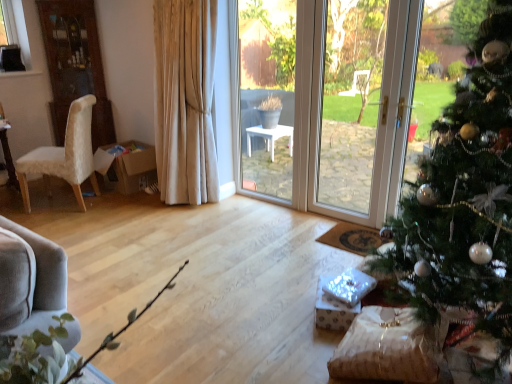
At what (x,y) coordinates should I click in order to perform the action: click on white plush chair at left. Please return your answer as a coordinate pair (x, y). The image size is (512, 384). Looking at the image, I should click on (64, 156).

Image resolution: width=512 pixels, height=384 pixels. Describe the element at coordinates (64, 156) in the screenshot. I see `white plush chair at left` at that location.

The height and width of the screenshot is (384, 512). What do you see at coordinates (464, 200) in the screenshot?
I see `green matte christmas tree at right` at bounding box center [464, 200].

You are a GUI agent. You are given a task and a screenshot of the screen. Output one action in this format:
    pyautogui.click(x=<x>, y=<y>)
    Task: Click on the green matte christmas tree at right
    
    Given the screenshot: What is the action you would take?
    pyautogui.click(x=464, y=200)

Identify the location of white plush chair at left. Image resolution: width=512 pixels, height=384 pixels. (64, 156).

Is green matte christmas tree at right to the left or to the right of white plush chair at left in the image?

From the image, it's evident that green matte christmas tree at right is to the right of white plush chair at left.

Does green matte christmas tree at right come in front of white plush chair at left?

Yes, the depth of green matte christmas tree at right is less than that of white plush chair at left.

Which point is more distant from viewer, (504, 339) or (82, 135)?

Point (82, 135)

From the image's perspective, is green matte christmas tree at right over white plush chair at left?

No, from the image's perspective, green matte christmas tree at right is not on top of white plush chair at left.

From a real-world perspective, is green matte christmas tree at right located beneath white plush chair at left?

Actually, green matte christmas tree at right is physically above white plush chair at left in the real world.

Considering the sizes of objects green matte christmas tree at right and white plush chair at left in the image provided, who is thinner, green matte christmas tree at right or white plush chair at left?

white plush chair at left is thinner.

Is green matte christmas tree at right taller or shorter than white plush chair at left?

green matte christmas tree at right is taller than white plush chair at left.

Based on their sizes in the image, would you say green matte christmas tree at right is bigger or smaller than white plush chair at left?

Clearly, green matte christmas tree at right is larger in size than white plush chair at left.

Consider the image. Would you say green matte christmas tree at right contains white plush chair at left?

No, green matte christmas tree at right does not contain white plush chair at left.

Are green matte christmas tree at right and white plush chair at left located far from each other?

green matte christmas tree at right is positioned a significant distance from white plush chair at left.

Could you tell me if green matte christmas tree at right is turned towards white plush chair at left?

No.

In the image, there is a white plush chair at left. What are the coordinates of `christmas tree below it (from the image's perspective)` in the screenshot? It's located at (464, 200).

In the image, is white plush chair at left on the left side or the right side of green matte christmas tree at right?

Clearly, white plush chair at left is on the left of green matte christmas tree at right in the image.

Is white plush chair at left in front of green matte christmas tree at right?

No, it is behind green matte christmas tree at right.

Is point (75, 132) behind point (490, 84)?

That is True.

From the picture: From the image's perspective, which is above, white plush chair at left or green matte christmas tree at right?

white plush chair at left appears higher in the image.

From a real-world perspective, is white plush chair at left below green matte christmas tree at right?

Indeed, from a real-world perspective, white plush chair at left is positioned beneath green matte christmas tree at right.

Considering the sizes of objects white plush chair at left and green matte christmas tree at right in the image provided, who is wider, white plush chair at left or green matte christmas tree at right?

green matte christmas tree at right.

Consider the image. Is white plush chair at left taller than green matte christmas tree at right?

Incorrect, the height of white plush chair at left is not larger of that of green matte christmas tree at right.

Who is smaller, white plush chair at left or green matte christmas tree at right?

Smaller between the two is white plush chair at left.

Is white plush chair at left situated inside green matte christmas tree at right or outside?

white plush chair at left exists outside the volume of green matte christmas tree at right.

Is there a large distance between white plush chair at left and green matte christmas tree at right?

Yes.

Is green matte christmas tree at right at the back of white plush chair at left?

No, white plush chair at left is not facing the opposite direction of green matte christmas tree at right.

The image size is (512, 384). In the image, there is a green matte christmas tree at right. Identify the location of chair below it (from a real-world perspective). (64, 156).

Find the location of a particular element. The image size is (512, 384). chair located behind the green matte christmas tree at right is located at coordinates (64, 156).

At what (x,y) coordinates should I click in order to perform the action: click on chair above the green matte christmas tree at right (from the image's perspective). Please return your answer as a coordinate pair (x, y). The width and height of the screenshot is (512, 384). Looking at the image, I should click on (64, 156).